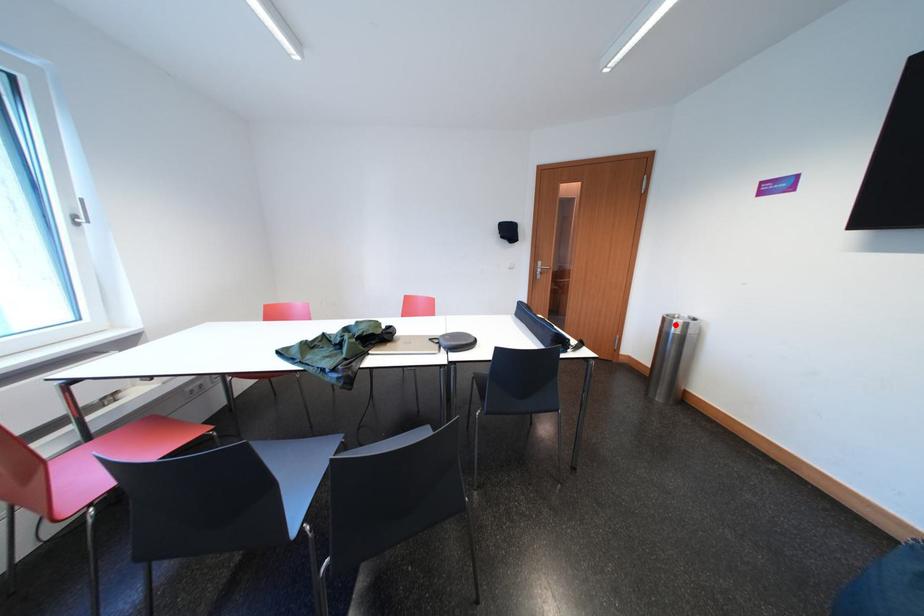
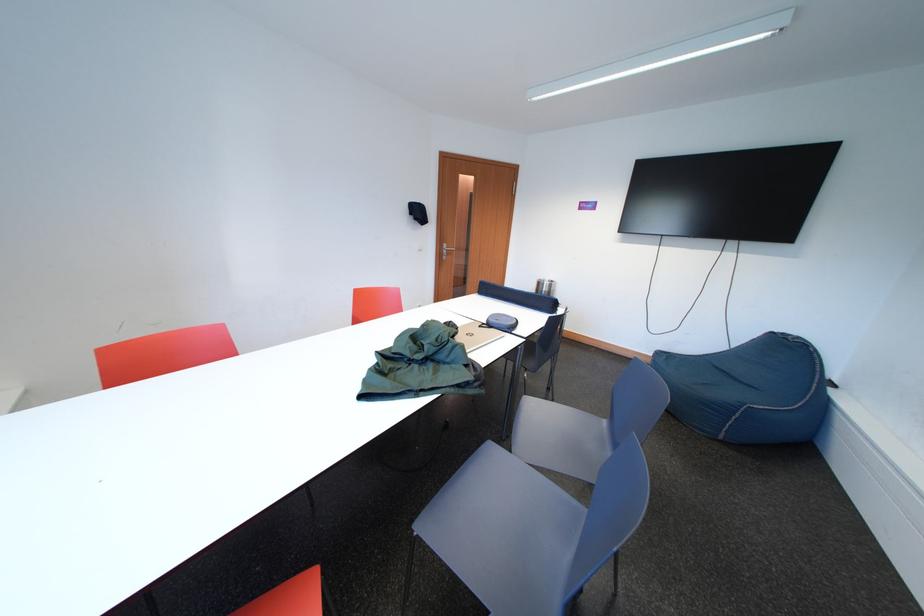
Question: I am providing you with two images of the same scene from different viewpoints. Given a red point in image1, look at the same physical point in image2. Is it:

Choices:
 (A) Closer to the viewpoint
 (B) Farther from the viewpoint

Answer: (A)